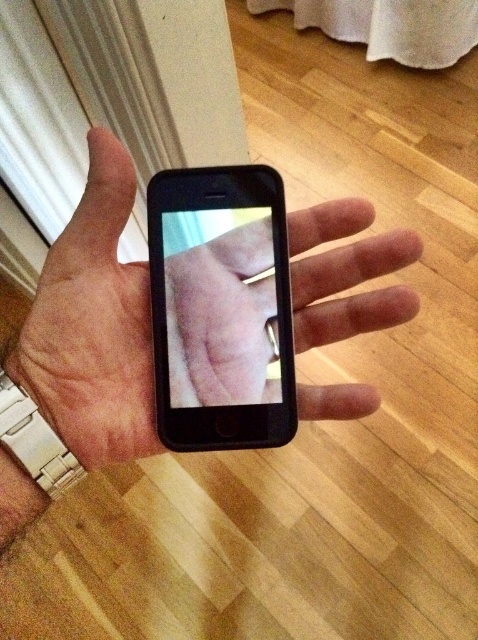
You are trying to take a photo of your phone screen. You see the black matte phone at center and the black matte smartphone at center in the frame. Which one is positioned higher in the image?

The black matte phone at center is located above the black matte smartphone at center, so it is positioned higher in the image.

You are trying to place both the black matte phone at center and the black matte smartphone at center into a rectangular case that can only hold one device at a time. Which device should you place first to ensure it fits?

The black matte smartphone at center should be placed first since it is narrower than the black matte phone at center, making it easier to fit into the case.

You are holding a smartphone with a black case and want to place it on a table. The table is 24 inches away from you. If the point where you want to place the phone is at point (341, 307), which is 18.73 inches away from you, will you be able to place the phone on the table without moving closer?

The point where you want to place the phone at point (341, 307) is 18.73 inches away from you, which is within the 24 inches distance of the table. Therefore, you can place the phone on the table without moving closer.